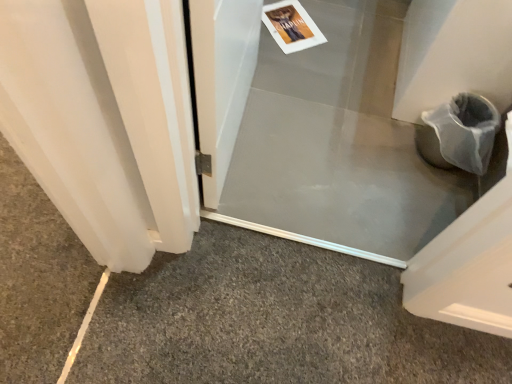
Question: Is transparent plastic screen door at center, which ranks as the 2th screen door in front-to-back order, at the right side of gray carpet at lower left?

Choices:
 (A) no
 (B) yes

Answer: (B)

Question: From a real-world perspective, is transparent plastic screen door at center, which ranks as the 2th screen door in front-to-back order, physically above gray carpet at lower left?

Choices:
 (A) no
 (B) yes

Answer: (A)

Question: Is transparent plastic screen door at center, which is counted as the 1th screen door, starting from the back, taller than gray carpet at lower left?

Choices:
 (A) yes
 (B) no

Answer: (B)

Question: Is transparent plastic screen door at center, which is counted as the 1th screen door, starting from the back, oriented towards gray carpet at lower left?

Choices:
 (A) yes
 (B) no

Answer: (A)

Question: Considering the relative sizes of transparent plastic screen door at center, which ranks as the 2th screen door in front-to-back order, and gray carpet at lower left in the image provided, is transparent plastic screen door at center, which ranks as the 2th screen door in front-to-back order, wider than gray carpet at lower left?

Choices:
 (A) no
 (B) yes

Answer: (B)

Question: From a real-world perspective, is transparent plastic screen door at center, which is counted as the 1th screen door, starting from the back, under gray carpet at lower left?

Choices:
 (A) no
 (B) yes

Answer: (B)

Question: Considering the relative positions of gray carpet at lower left and transparent plastic screen door at center, which is counted as the 1th screen door, starting from the back, in the image provided, is gray carpet at lower left to the left of transparent plastic screen door at center, which is counted as the 1th screen door, starting from the back, from the viewer's perspective?

Choices:
 (A) yes
 (B) no

Answer: (A)

Question: Does gray carpet at lower left have a greater width compared to transparent plastic screen door at center, which ranks as the 2th screen door in front-to-back order?

Choices:
 (A) no
 (B) yes

Answer: (A)

Question: Is gray carpet at lower left at the right side of transparent plastic screen door at center, which is counted as the 1th screen door, starting from the back?

Choices:
 (A) yes
 (B) no

Answer: (B)

Question: Can you confirm if gray carpet at lower left is shorter than transparent plastic screen door at center, which ranks as the 2th screen door in front-to-back order?

Choices:
 (A) no
 (B) yes

Answer: (A)

Question: Would you say gray carpet at lower left is outside transparent plastic screen door at center, which is counted as the 1th screen door, starting from the back?

Choices:
 (A) yes
 (B) no

Answer: (A)

Question: Is gray carpet at lower left touching transparent plastic screen door at center, which ranks as the 2th screen door in front-to-back order?

Choices:
 (A) yes
 (B) no

Answer: (B)

Question: Is clear plastic screen door at center, the second screen door positioned from the back, outside gray carpet at lower left?

Choices:
 (A) no
 (B) yes

Answer: (B)